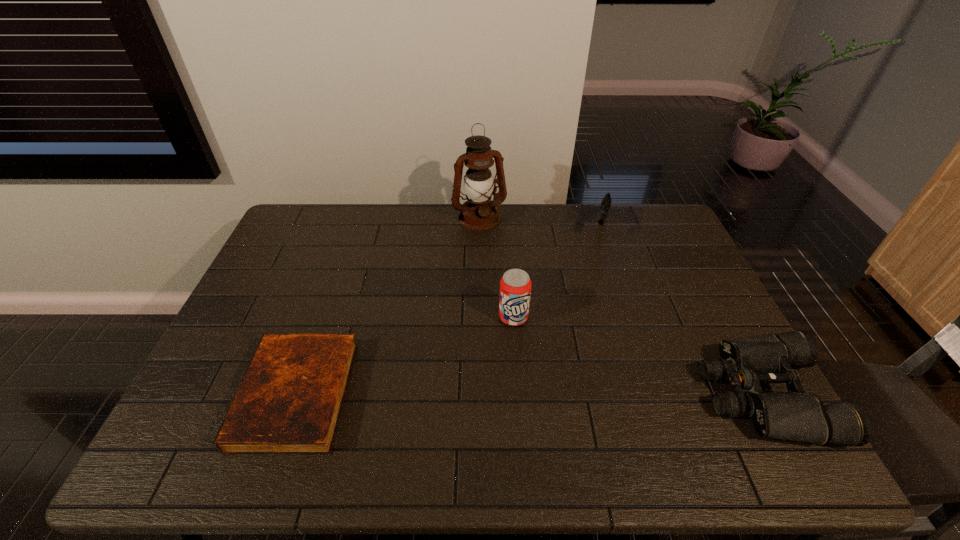
I want to click on vacant point located 0.330m on the side of the tallest object, there is a wick adjustment knob, so click(515, 294).

Locate an element on the screen. free space located at the end of the barrel of the gun is located at coordinates (590, 288).

Locate an element on the screen. The image size is (960, 540). free spot located 0.110m at the end of the barrel of the gun is located at coordinates (597, 264).

I want to click on vacant space situated 0.130m at the end of the barrel of the gun, so click(x=595, y=268).

I want to click on lantern present at the far edge, so click(480, 213).

Identify the location of gun that is at the far edge. (606, 202).

At what (x,y) coordinates should I click in order to perform the action: click on Bible that is at the near edge. Please return your answer as a coordinate pair (x, y). Looking at the image, I should click on (289, 401).

The width and height of the screenshot is (960, 540). I want to click on binoculars at the near edge, so click(x=796, y=415).

I want to click on object at the left edge, so coord(289,401).

Where is `object that is positioned at the right edge`? Image resolution: width=960 pixels, height=540 pixels. object that is positioned at the right edge is located at coordinates (796, 415).